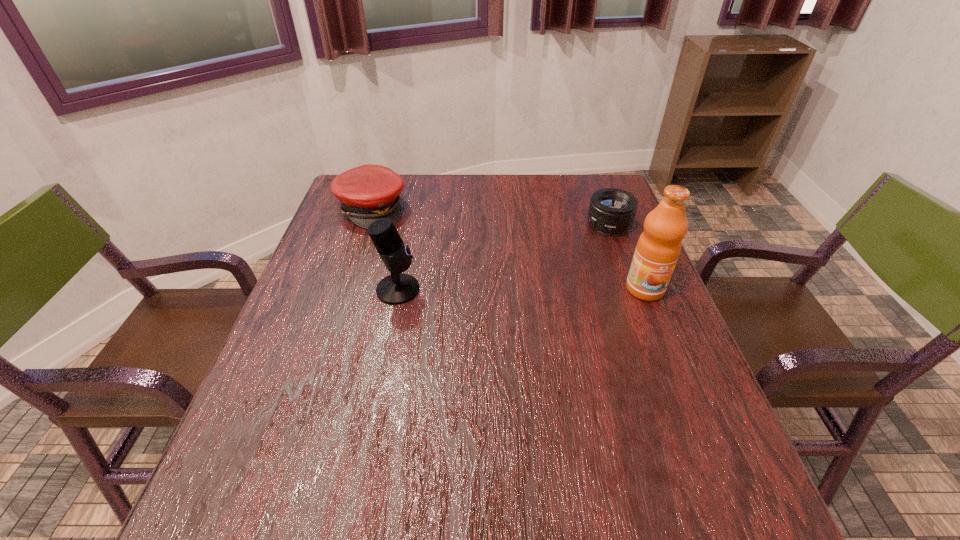
The width and height of the screenshot is (960, 540). Find the location of `free spot between the telephoto lens and the tallest object`. free spot between the telephoto lens and the tallest object is located at coordinates (627, 257).

Locate an element on the screen. The image size is (960, 540). free space that is in between the fruit juice and the second tallest object is located at coordinates (521, 289).

Identify which object is located as the nearest to the fruit juice. Please provide its 2D coordinates. Your answer should be formatted as a tuple, i.e. [(x, y)], where the tuple contains the x and y coordinates of a point satisfying the conditions above.

[(612, 211)]

Where is `object that stands as the closest to the tallest object`? This screenshot has height=540, width=960. object that stands as the closest to the tallest object is located at coordinates (612, 211).

Image resolution: width=960 pixels, height=540 pixels. Identify the location of vacant area that satisfies the following two spatial constraints: 1. on the front side of the second shortest object; 2. on the stand of the third shortest object. (346, 289).

I want to click on free space that satisfies the following two spatial constraints: 1. on the front side of the second shortest object; 2. on the stand of the microphone, so click(x=346, y=289).

Locate an element on the screen. free region that satisfies the following two spatial constraints: 1. on the front side of the third shortest object; 2. on the stand of the third tallest object is located at coordinates (346, 289).